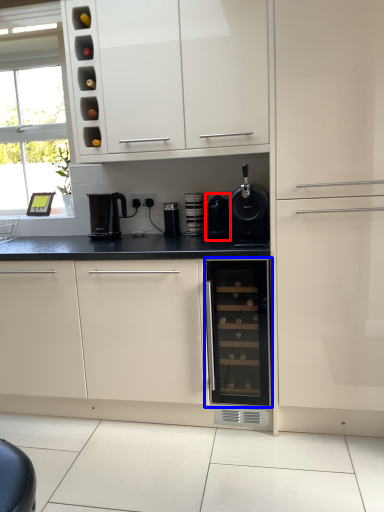
Question: Which of the following is the closest to the observer, appliance (highlighted by a red box) or home appliance (highlighted by a blue box)?

Choices:
 (A) appliance
 (B) home appliance

Answer: (B)